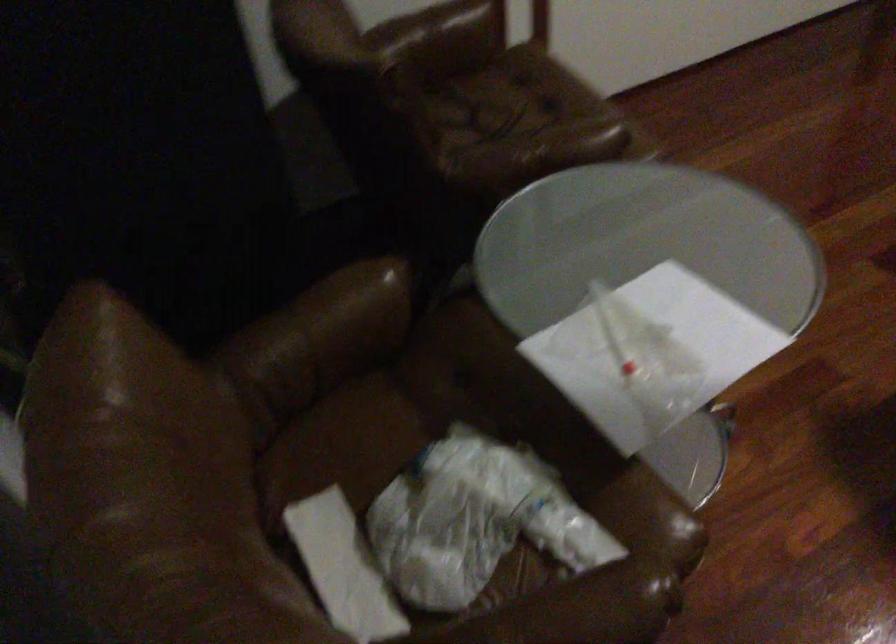
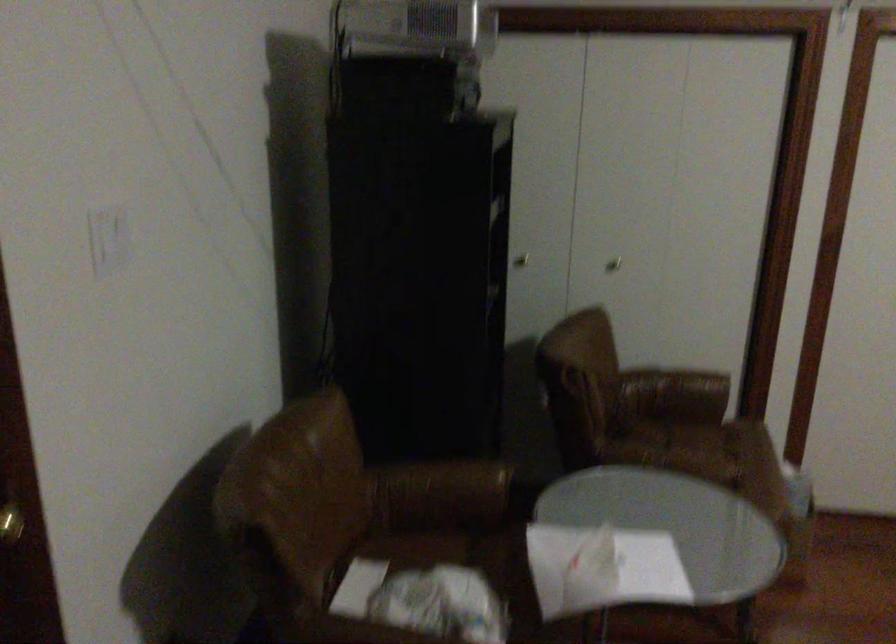
First-person continuous shooting, in which direction is the camera rotating?

The camera rotated toward left-up.